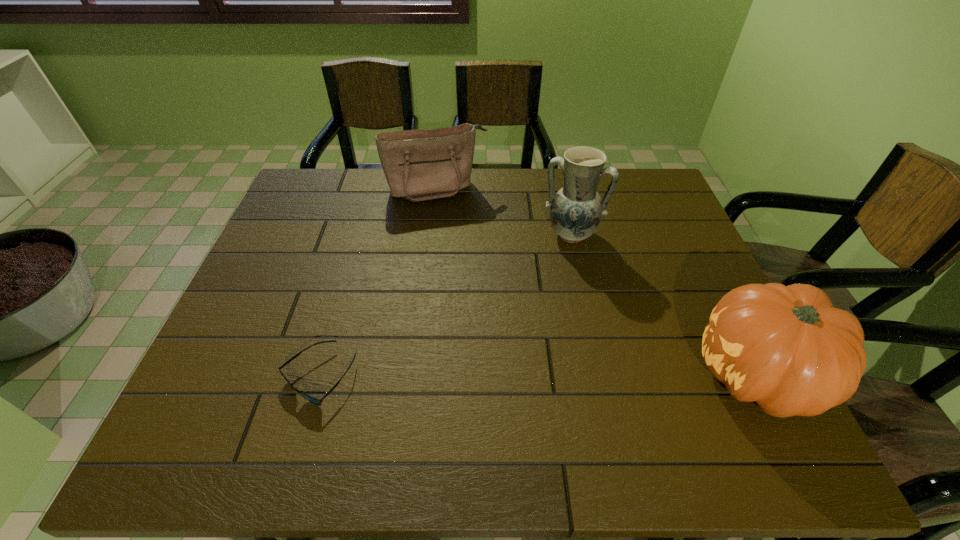
Identify the location of vacant region located on either side of the second object from right to left. The image size is (960, 540). (550, 299).

I want to click on vacant region located on the front pocket of the shoulder bag, so click(x=456, y=226).

This screenshot has width=960, height=540. In order to click on free space located 0.260m on the front pocket of the shoulder bag in this screenshot , I will do 468,260.

Locate an element on the screen. The width and height of the screenshot is (960, 540). free point located 0.060m on the front pocket of the shoulder bag is located at coordinates (x=452, y=216).

Locate an element on the screen. Image resolution: width=960 pixels, height=540 pixels. object located in the far edge section of the desktop is located at coordinates (419, 165).

Where is `sunglasses at the near edge`? sunglasses at the near edge is located at coordinates (313, 400).

This screenshot has width=960, height=540. Find the location of `pumpkin present at the near edge`. pumpkin present at the near edge is located at coordinates (786, 347).

You are a GUI agent. You are given a task and a screenshot of the screen. Output one action in this format:
    pyautogui.click(x=<x>, y=<y>)
    Task: Click on the object present at the right edge
    This screenshot has height=540, width=960.
    Given the screenshot: What is the action you would take?
    pyautogui.click(x=786, y=347)

The height and width of the screenshot is (540, 960). What are the coordinates of `object that is at the near right corner` in the screenshot? It's located at (786, 347).

This screenshot has width=960, height=540. Identify the location of free space at the far edge. (492, 200).